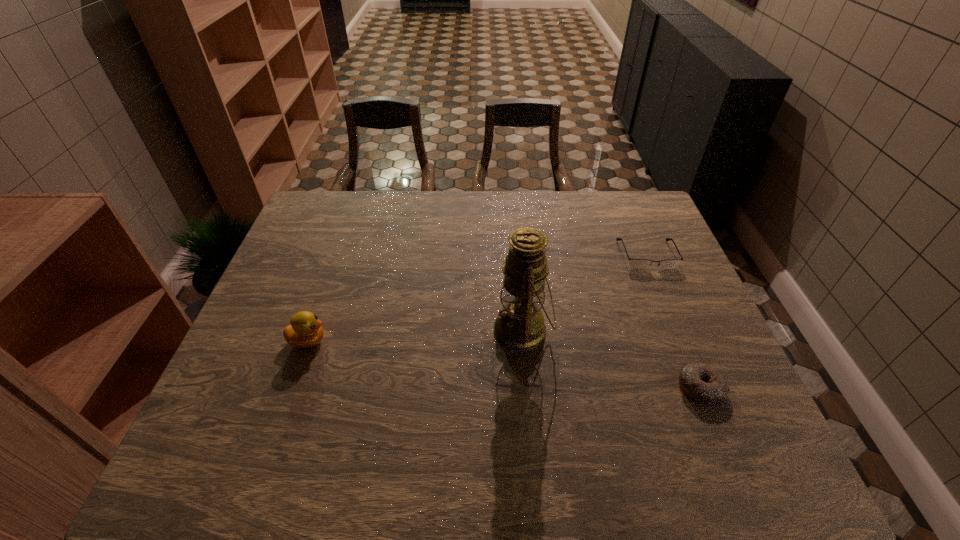
Where is `free location that satisfies the following two spatial constraints: 1. on the front side of the second object from left to right; 2. on the face of the second tallest object`? The height and width of the screenshot is (540, 960). free location that satisfies the following two spatial constraints: 1. on the front side of the second object from left to right; 2. on the face of the second tallest object is located at coordinates (524, 341).

Find the location of a particular element. This screenshot has height=540, width=960. free space that satisfies the following two spatial constraints: 1. on the back side of the nearest object; 2. on the face of the duckling is located at coordinates (681, 341).

Where is `free space that satisfies the following two spatial constraints: 1. on the back side of the nearest object; 2. on the face of the leftmost object`? The image size is (960, 540). free space that satisfies the following two spatial constraints: 1. on the back side of the nearest object; 2. on the face of the leftmost object is located at coordinates (681, 341).

You are a GUI agent. You are given a task and a screenshot of the screen. Output one action in this format:
    pyautogui.click(x=<x>, y=<y>)
    Task: Click on the free point that satisfies the following two spatial constraints: 1. on the front side of the oil lamp; 2. on the face of the third shortest object
    The image size is (960, 540).
    Given the screenshot: What is the action you would take?
    pyautogui.click(x=524, y=341)

Identify the location of vacant space that satisfies the following two spatial constraints: 1. on the front-facing side of the spectacles; 2. on the face of the duckling. (x=683, y=341).

I want to click on vacant space that satisfies the following two spatial constraints: 1. on the front-facing side of the farthest object; 2. on the face of the second tallest object, so click(683, 341).